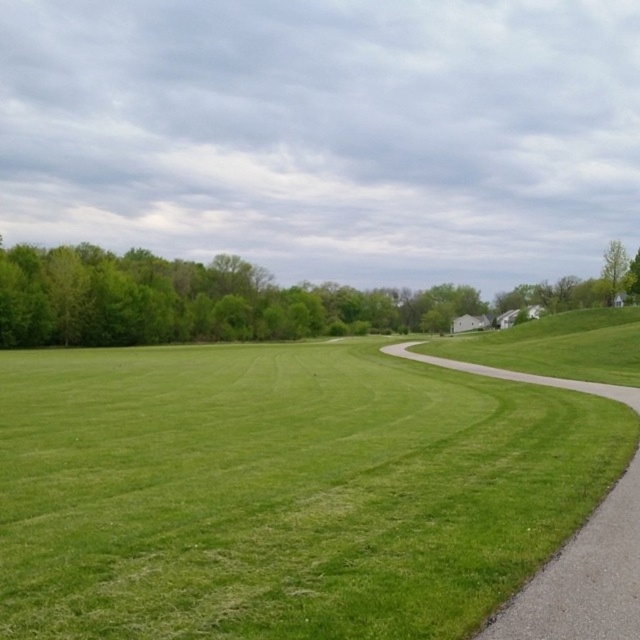
You are standing at the center of the image and want to walk towards the green leafy tree at left. Which direction should you face to head directly towards it?

Since the green leafy tree at left is located at point (193, 300) in the image, you should face towards the left direction to head directly towards it.

You are standing on the gravel path at right and want to see the green leafy tree at left. Is the tree visible from your current position?

The green leafy tree at left is above the gravel path at right, so yes, the tree is visible from your current position on the gravel path at right.

You are standing on the gravel path at right and want to see the houses in the background. Is the green leafy tree at left blocking your view?

The gravel path at right is behind the green leafy tree at left, so the tree is in front of the path. Since you are on the path, the tree would block your view of the houses in the background.